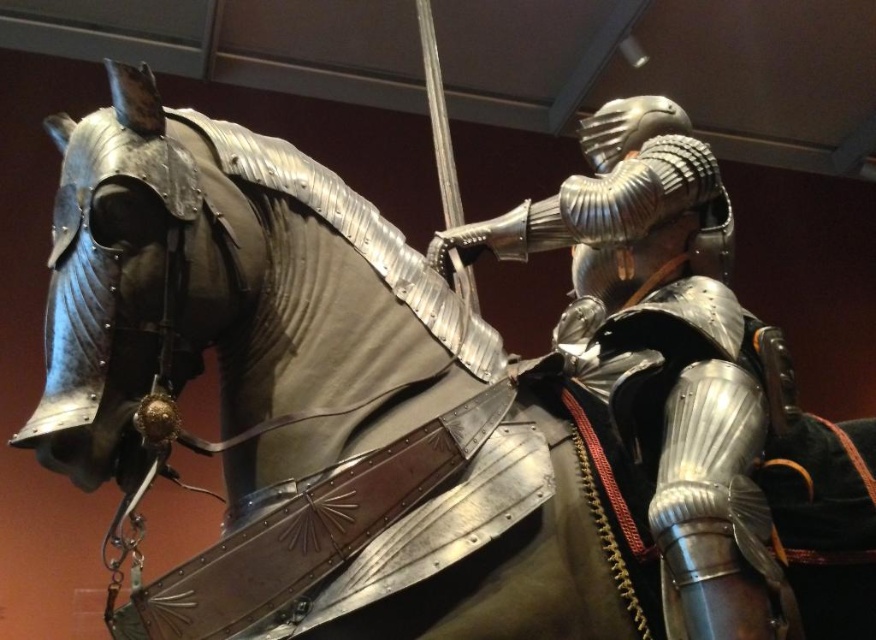
You are a medieval knight preparing for a jousting tournament. You are standing 5 meters away from the shiny silver armor at center displayed in the image. If you need to grab your lance from the armor, will you be able to reach it without moving closer?

The shiny silver armor at center is 5.04 meters away from the viewer. Since you are standing 5 meters away, you are slightly farther than the armor, so you cannot reach the lance without moving closer.